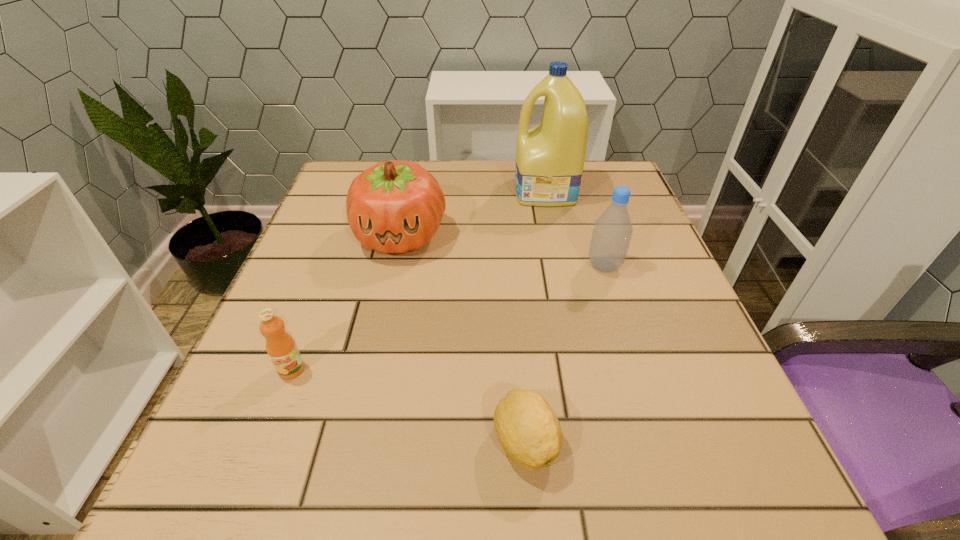
The height and width of the screenshot is (540, 960). In order to click on unoccupied area between the fourth tallest object and the fourth object from right to left in this screenshot , I will do `click(346, 302)`.

Locate an element on the screen. empty space between the bottle and the second object from left to right is located at coordinates (502, 251).

Identify the location of free area in between the lemon and the detergent. This screenshot has width=960, height=540. (535, 317).

At what (x,y) coordinates should I click in order to perform the action: click on vacant space in between the bottle and the fourth farthest object. Please return your answer as a coordinate pair (x, y). The height and width of the screenshot is (540, 960). Looking at the image, I should click on (447, 318).

Where is `free space that is in between the tallest object and the second nearest object`? This screenshot has height=540, width=960. free space that is in between the tallest object and the second nearest object is located at coordinates (419, 280).

This screenshot has width=960, height=540. In order to click on free space that is in between the shortest object and the leftmost object in this screenshot , I will do `click(408, 406)`.

Image resolution: width=960 pixels, height=540 pixels. I want to click on vacant area between the lemon and the fourth farthest object, so click(408, 406).

Identify the location of free space between the leftmost object and the bottle. (447, 318).

Identify the location of blank region between the detergent and the pumpkin. (472, 214).

Where is `object identified as the third closest to the bottle`? The width and height of the screenshot is (960, 540). object identified as the third closest to the bottle is located at coordinates (527, 428).